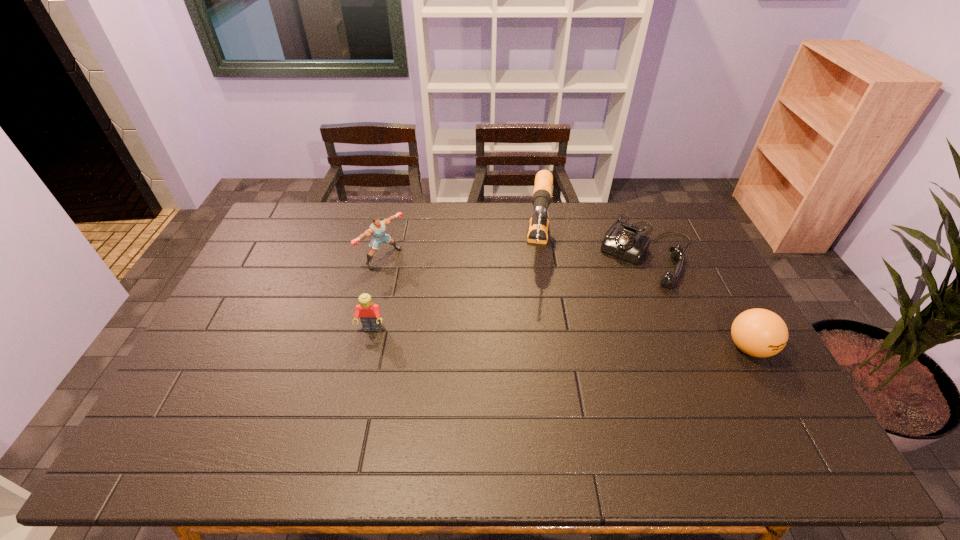
The height and width of the screenshot is (540, 960). Identify the location of the fourth closest object to the drill. (758, 332).

The image size is (960, 540). I want to click on vacant area that satisfies the following two spatial constraints: 1. on the back side of the third object from left to right; 2. on the right side of the puncher, so click(x=385, y=248).

Image resolution: width=960 pixels, height=540 pixels. I want to click on free space that satisfies the following two spatial constraints: 1. on the front side of the third object from left to right; 2. on the left side of the telephone, so pyautogui.click(x=540, y=249).